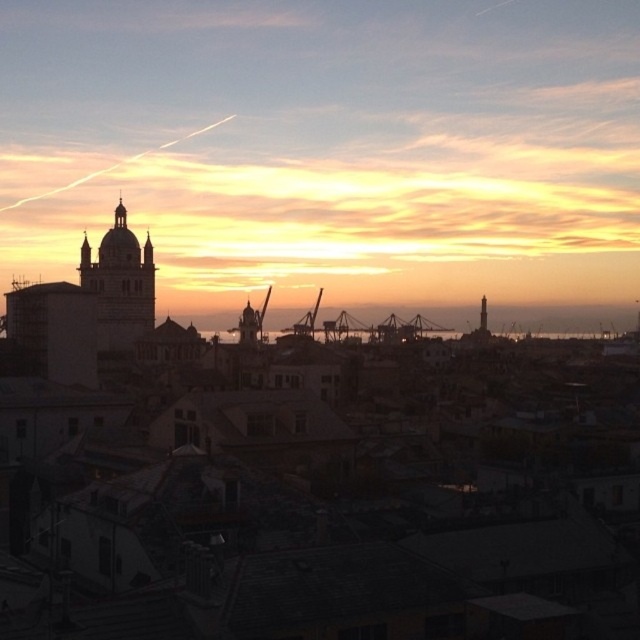
Who is more forward, (250, 323) or (305, 317)?

Point (305, 317) is more forward.

Where is `metallic gray crane at center`? metallic gray crane at center is located at coordinates (252, 323).